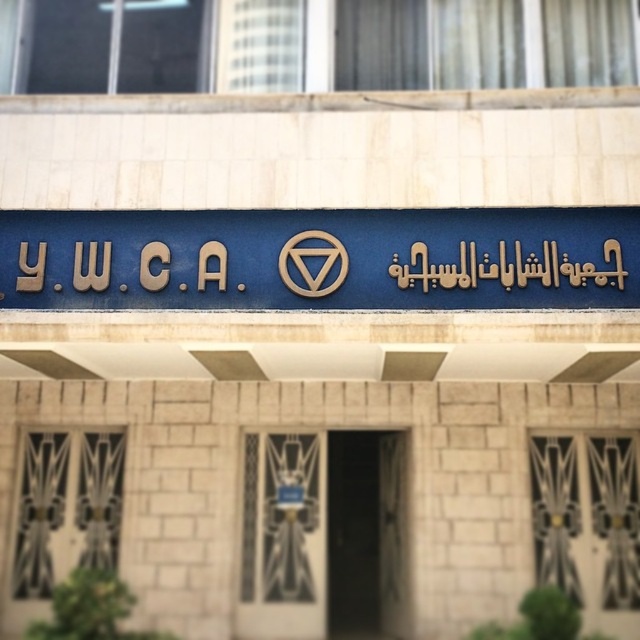
You are a visitor approaching the building and want to read both the blue metallic sign at center and the gold metallic signboard at center. Which one will you see first as you approach the entrance?

The blue metallic sign at center is located above the gold metallic signboard at center, so you will see the blue metallic sign at center first as you approach the entrance.

You are standing in front of the building and want to determine which of the two points, point (236, 244) or point (589, 273), is closer to you. Based on the signboard and building details, which point is nearer?

Point (236, 244) is closer to you because it is further to the viewer than point (589, 273) according to the spatial description.